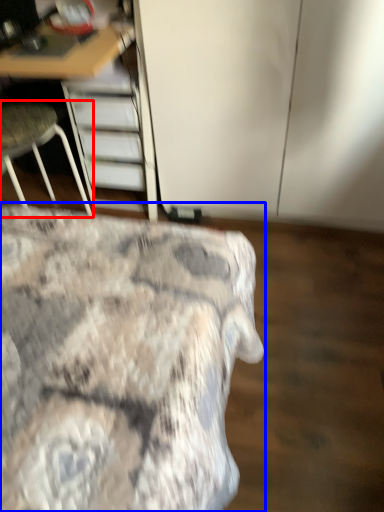
Question: Which point is closer to the camera, chair (highlighted by a red box) or bed (highlighted by a blue box)?

Choices:
 (A) chair
 (B) bed

Answer: (B)